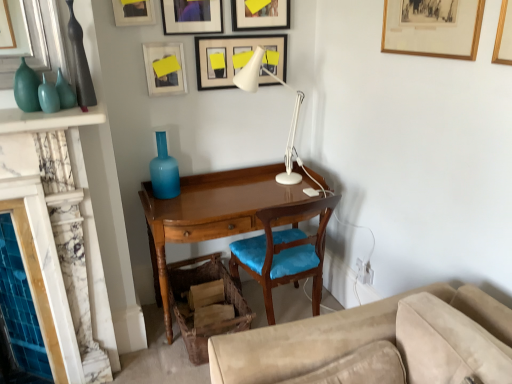
Question: Is point (25, 91) positioned closer to the camera than point (312, 276)?

Choices:
 (A) closer
 (B) farther

Answer: (A)

Question: Do you think matte teal glass vase at upper left, the 3th glass vase viewed from the back, is within wooden chair with blue cushion at center, or outside of it?

Choices:
 (A) outside
 (B) inside

Answer: (A)

Question: Which of these objects is positioned closest to the white glossy table lamp at center?

Choices:
 (A) wooden chair with blue cushion at center
 (B) matte teal glass vase at upper left, placed as the 3th glass vase when sorted from right to left
 (C) matte glass vases at left
 (D) matte black vase at left
 (E) matte black picture frame at upper center, which is the fourth picture frame in right-to-left order

Answer: (E)

Question: Considering the real-world distances, which object is closest to the white matte picture frame at upper center, marked as the 2th picture frame in a left-to-right arrangement?

Choices:
 (A) mahogany wood desk at center
 (B) matte blue glass vase at center, which is the third glass vase in left-to-right order
 (C) matte black picture frame at upper center, the 3th picture frame positioned from the left
 (D) beige suede studio couch at lower right
 (E) wooden picture frame at upper center, acting as the first picture frame starting from the left

Answer: (C)